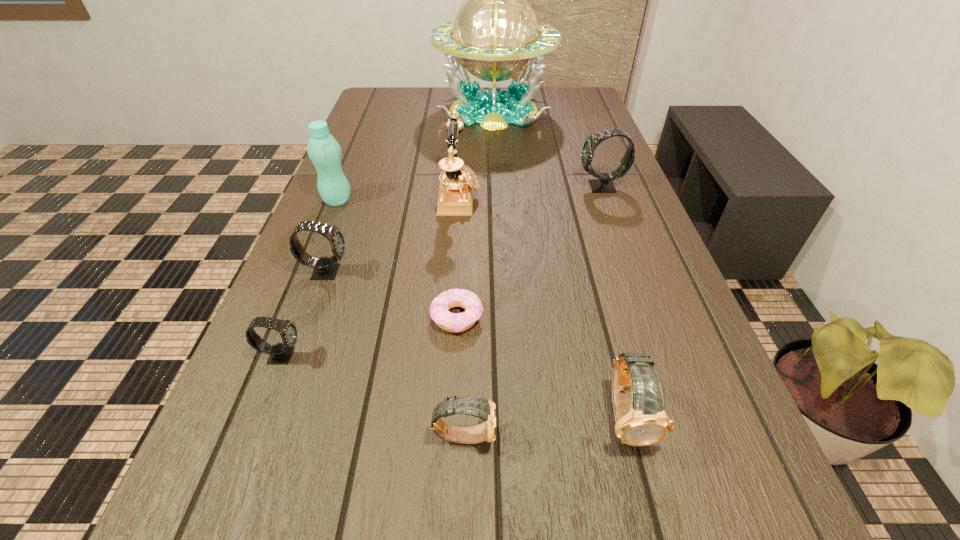
Where is `the left gold watch`? Image resolution: width=960 pixels, height=540 pixels. the left gold watch is located at coordinates (482, 408).

What are the coordinates of `the nearest gray watch` in the screenshot? It's located at (280, 354).

At what (x,y) coordinates should I click in order to perform the action: click on the smallest gray watch. Please return your answer as a coordinate pair (x, y). The width and height of the screenshot is (960, 540). Looking at the image, I should click on (280, 354).

Image resolution: width=960 pixels, height=540 pixels. What are the coordinates of `pink doughnut` in the screenshot? It's located at (450, 322).

Identify the location of doughnut. This screenshot has width=960, height=540. (450, 322).

This screenshot has height=540, width=960. I want to click on vacant region located on the front of the globe, so click(x=496, y=171).

The width and height of the screenshot is (960, 540). I want to click on free space located 0.380m on the front of the bottle, so click(282, 334).

Where is `vacant space located 0.170m on the dial of the telephone`? The height and width of the screenshot is (540, 960). vacant space located 0.170m on the dial of the telephone is located at coordinates (549, 198).

I want to click on free region located 0.110m on the face of the farthest watch, so click(535, 187).

Locate an element on the screen. The width and height of the screenshot is (960, 540). vacant area situated on the face of the farthest watch is located at coordinates (444, 187).